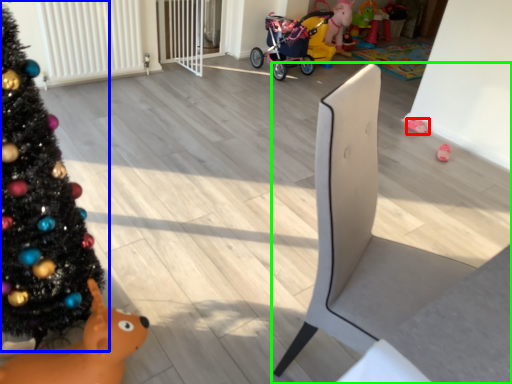
Question: Which object is positioned closest to toy (highlighted by a red box)? Select from christmas tree (highlighted by a blue box) and furniture (highlighted by a green box).

Choices:
 (A) christmas tree
 (B) furniture

Answer: (B)